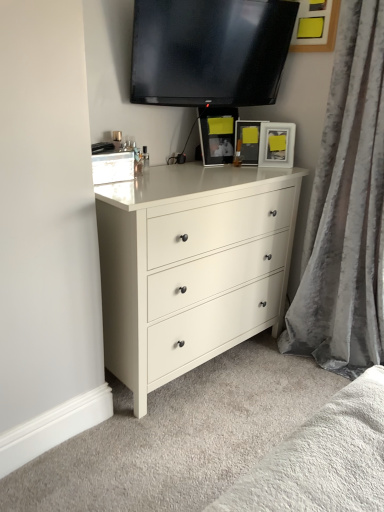
Question: Is matte white dresser at center bigger or smaller than matte black picture frame at center, which is the second picture frame from left to right?

Choices:
 (A) small
 (B) big

Answer: (B)

Question: Relative to matte black picture frame at center, which is the second picture frame from left to right, is matte white dresser at center in front or behind?

Choices:
 (A) front
 (B) behind

Answer: (A)

Question: Estimate the real-world distances between objects in this image. Which object is closer to the matte black picture frame at upper right, the 1th picture frame viewed from the right?

Choices:
 (A) matte white dresser at center
 (B) black glossy tv at upper center
 (C) matte black picture frame at upper center, which ranks as the 3th picture frame in right-to-left order
 (D) matte black picture frame at center, which is the second picture frame from left to right
 (E) velvet gray curtain at right

Answer: (D)

Question: Which of these objects is positioned closest to the velvet gray curtain at right?

Choices:
 (A) black glossy tv at upper center
 (B) matte white dresser at center
 (C) matte black picture frame at center, which is the second picture frame from left to right
 (D) matte black picture frame at upper center, which ranks as the 3th picture frame in right-to-left order
 (E) matte black picture frame at upper right, the 1th picture frame viewed from the right

Answer: (E)